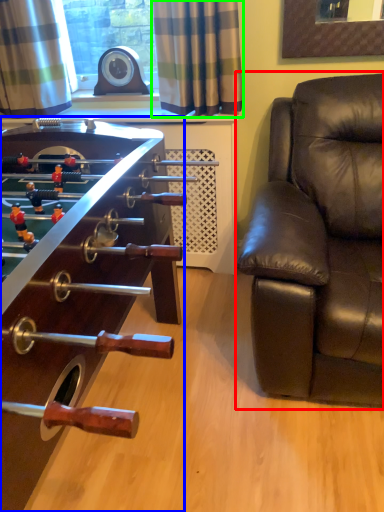
Question: Which object is positioned closest to studio couch (highlighted by a red box)? Select from table (highlighted by a blue box) and curtain (highlighted by a green box).

Choices:
 (A) table
 (B) curtain

Answer: (B)